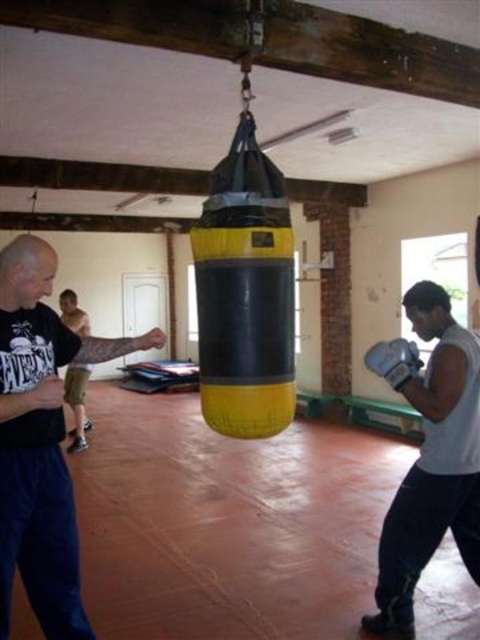
Question: Which point is farther to the camera?

Choices:
 (A) (24, 440)
 (B) (425, 372)
 (C) (420, 360)

Answer: (C)

Question: Estimate the real-world distances between objects in this image. Which object is farther from the matte black shirt at left?

Choices:
 (A) white synthetic boxing glove at lower right
 (B) white matte boxing gloves at center

Answer: (A)

Question: Is white matte boxing gloves at center to the left of white synthetic boxing glove at lower right from the viewer's perspective?

Choices:
 (A) no
 (B) yes

Answer: (A)

Question: Does matte black shirt at left have a larger size compared to white matte boxing gloves at center?

Choices:
 (A) yes
 (B) no

Answer: (A)

Question: Which point is closer to the camera taking this photo?

Choices:
 (A) (25, 241)
 (B) (406, 579)

Answer: (A)

Question: Can you confirm if matte black shirt at left is smaller than white matte boxing gloves at center?

Choices:
 (A) no
 (B) yes

Answer: (A)